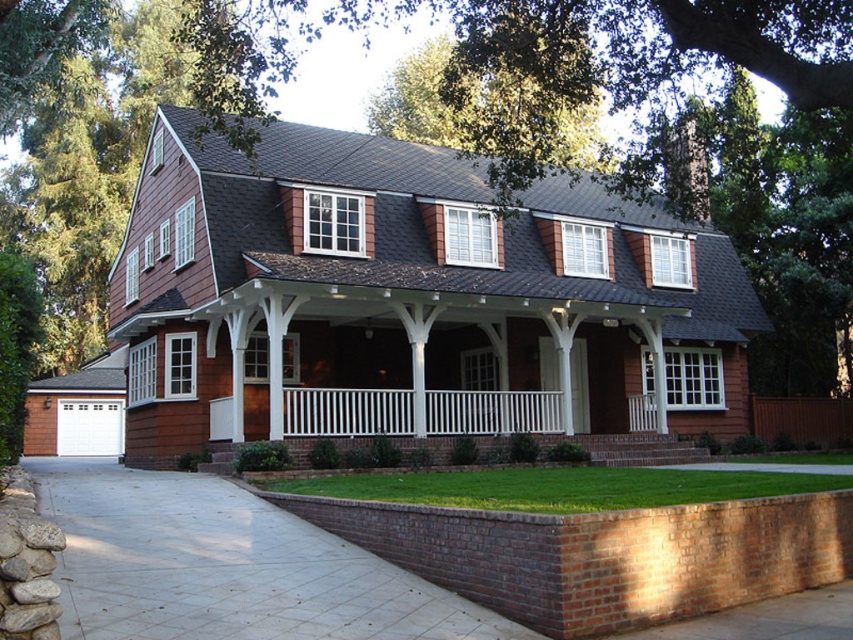
Question: Is gray concrete driveway at lower left positioned at the back of white painted wood porch at center?

Choices:
 (A) no
 (B) yes

Answer: (A)

Question: Can you confirm if gray concrete driveway at lower left is positioned to the right of white painted wood porch at center?

Choices:
 (A) yes
 (B) no

Answer: (B)

Question: Is gray concrete driveway at lower left smaller than white painted wood porch at center?

Choices:
 (A) no
 (B) yes

Answer: (A)

Question: Which object is closer to the camera taking this photo?

Choices:
 (A) gray concrete driveway at lower left
 (B) white painted wood porch at center

Answer: (A)

Question: Which of the following is the closest to the observer?

Choices:
 (A) (498, 412)
 (B) (351, 628)

Answer: (B)